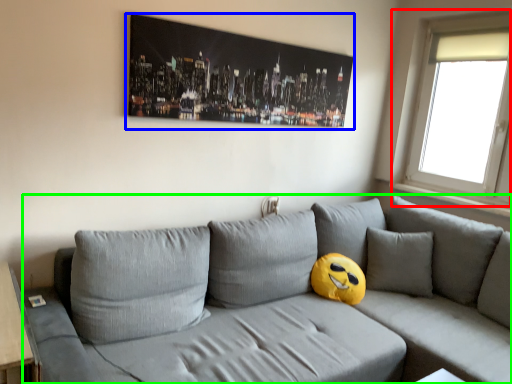
Question: Which object is positioned farthest from window (highlighted by a red box)? Select from picture frame (highlighted by a blue box) and studio couch (highlighted by a green box).

Choices:
 (A) picture frame
 (B) studio couch

Answer: (A)